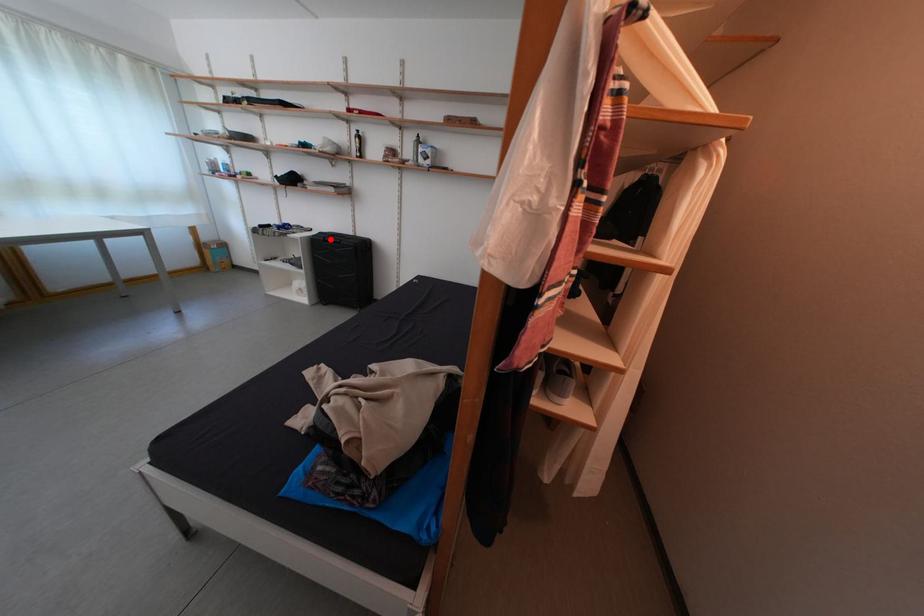
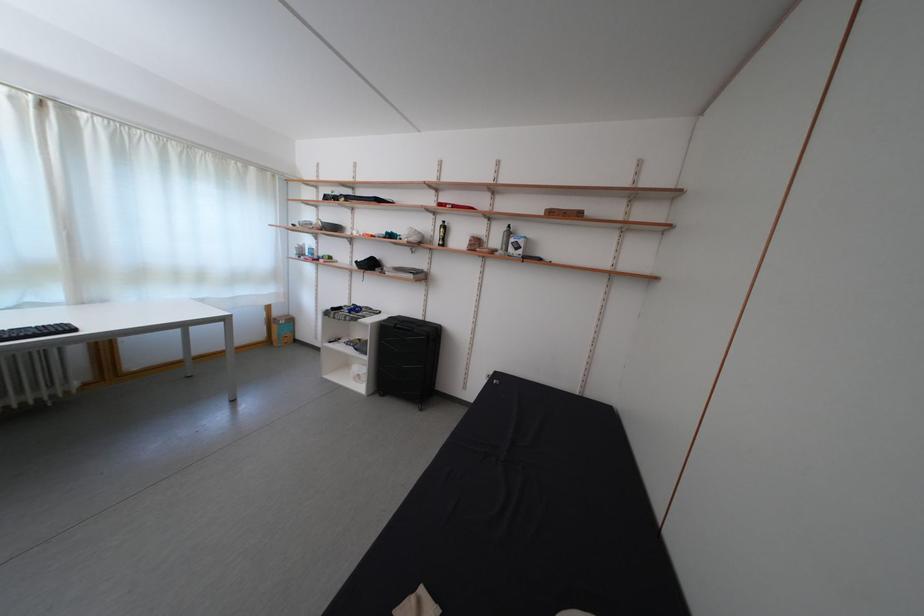
In the second image, find the point that corresponds to the highlighted location in the first image.

(399, 323)